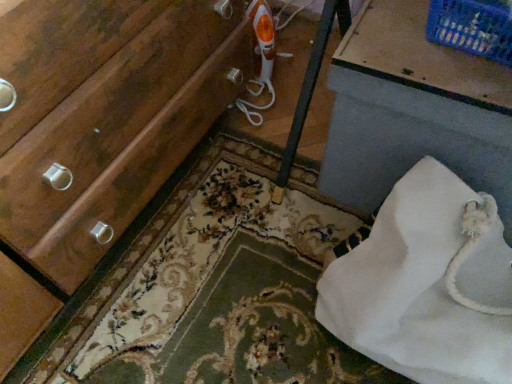
Question: Is white fabric bag at lower right far from blue plastic basket at upper right?

Choices:
 (A) no
 (B) yes

Answer: (A)

Question: Is white fabric bag at lower right oriented away from blue plastic basket at upper right?

Choices:
 (A) no
 (B) yes

Answer: (A)

Question: Can you confirm if white fabric bag at lower right is smaller than blue plastic basket at upper right?

Choices:
 (A) no
 (B) yes

Answer: (A)

Question: From the image's perspective, does white fabric bag at lower right appear lower than blue plastic basket at upper right?

Choices:
 (A) no
 (B) yes

Answer: (B)

Question: Does white fabric bag at lower right turn towards blue plastic basket at upper right?

Choices:
 (A) no
 (B) yes

Answer: (A)

Question: From a real-world perspective, is white fabric bag at lower right positioned over blue plastic basket at upper right based on gravity?

Choices:
 (A) yes
 (B) no

Answer: (B)

Question: Can you confirm if white fabric bag at lower right is smaller than floral carpet at lower center?

Choices:
 (A) no
 (B) yes

Answer: (A)

Question: Is white fabric bag at lower right completely or partially outside of floral carpet at lower center?

Choices:
 (A) no
 (B) yes

Answer: (B)

Question: Considering the relative positions of white fabric bag at lower right and floral carpet at lower center in the image provided, is white fabric bag at lower right to the left of floral carpet at lower center from the viewer's perspective?

Choices:
 (A) no
 (B) yes

Answer: (A)

Question: Is white fabric bag at lower right bigger than floral carpet at lower center?

Choices:
 (A) yes
 (B) no

Answer: (A)

Question: Is white fabric bag at lower right turned away from floral carpet at lower center?

Choices:
 (A) yes
 (B) no

Answer: (B)

Question: Does white fabric bag at lower right turn towards floral carpet at lower center?

Choices:
 (A) yes
 (B) no

Answer: (B)

Question: From a real-world perspective, is blue plastic basket at upper right under floral carpet at lower center?

Choices:
 (A) yes
 (B) no

Answer: (B)